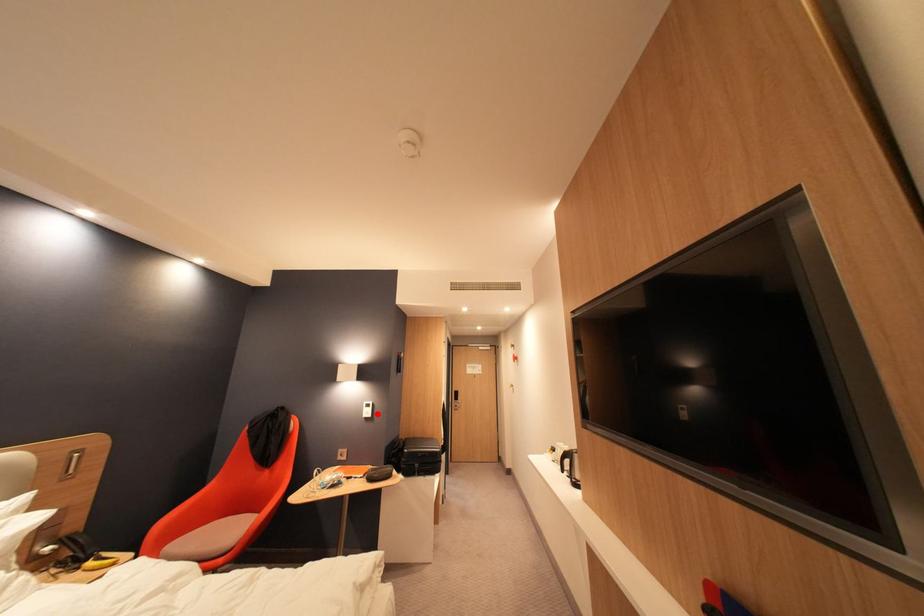
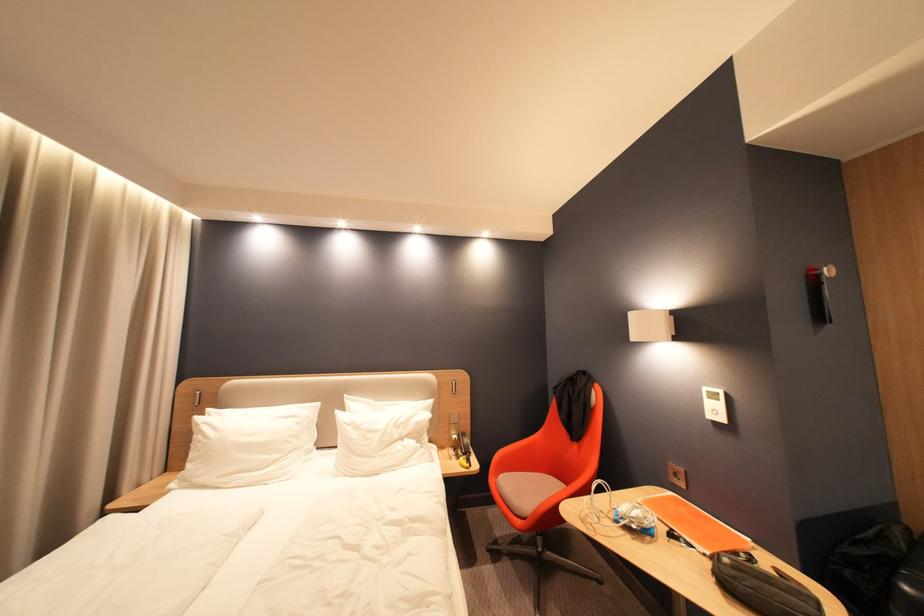
Where in the second image is the point corresponding to the highlighted location from the first image?

(724, 413)